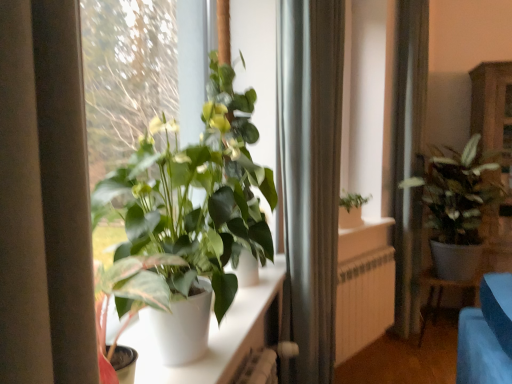
Question: From the image's perspective, does silky white curtain at right, the 2th curtain from the left, appear higher than white matte radiator at center?

Choices:
 (A) no
 (B) yes

Answer: (B)

Question: Considering the relative sizes of silky white curtain at right, which appears as the 1th curtain when viewed from the right, and white matte radiator at center in the image provided, is silky white curtain at right, which appears as the 1th curtain when viewed from the right, taller than white matte radiator at center?

Choices:
 (A) yes
 (B) no

Answer: (A)

Question: Does silky white curtain at right, the 2th curtain from the left, turn towards white matte radiator at center?

Choices:
 (A) yes
 (B) no

Answer: (B)

Question: Is silky white curtain at right, marked as the second curtain in a front-to-back arrangement, shorter than white matte radiator at center?

Choices:
 (A) yes
 (B) no

Answer: (B)

Question: From the image's perspective, does silky white curtain at right, the 2th curtain from the left, appear lower than white matte radiator at center?

Choices:
 (A) yes
 (B) no

Answer: (B)

Question: Visually, is textured green plant at right, positioned as the 2th houseplant in left-to-right order, positioned to the left or to the right of wooden cabinet at right?

Choices:
 (A) right
 (B) left

Answer: (B)

Question: From the image's perspective, is textured green plant at right, positioned as the 2th houseplant in left-to-right order, above or below wooden cabinet at right?

Choices:
 (A) above
 (B) below

Answer: (B)

Question: From their relative heights in the image, would you say textured green plant at right, the first houseplant in the back-to-front sequence, is taller or shorter than wooden cabinet at right?

Choices:
 (A) tall
 (B) short

Answer: (B)

Question: Is textured green plant at right, which is counted as the second houseplant, starting from the front, spatially inside wooden cabinet at right, or outside of it?

Choices:
 (A) outside
 (B) inside

Answer: (A)

Question: From the image's perspective, is textured green plant at right, positioned as the 2th houseplant in left-to-right order, positioned above or below white matte radiator at center?

Choices:
 (A) above
 (B) below

Answer: (A)

Question: Considering the relative positions of textured green plant at right, which is counted as the second houseplant, starting from the front, and white matte radiator at center in the image provided, is textured green plant at right, which is counted as the second houseplant, starting from the front, to the left or to the right of white matte radiator at center?

Choices:
 (A) right
 (B) left

Answer: (A)

Question: Is textured green plant at right, the first houseplant from the right, in front of or behind white matte radiator at center in the image?

Choices:
 (A) behind
 (B) front

Answer: (B)

Question: In terms of height, does textured green plant at right, which is counted as the second houseplant, starting from the front, look taller or shorter compared to white matte radiator at center?

Choices:
 (A) tall
 (B) short

Answer: (A)

Question: From the image's perspective, is green matte plant at center, the 2th houseplant in the back-to-front sequence, located above or below textured green plant at right, which is counted as the second houseplant, starting from the front?

Choices:
 (A) above
 (B) below

Answer: (A)

Question: From a real-world perspective, relative to textured green plant at right, which is counted as the second houseplant, starting from the front, is green matte plant at center, which appears as the second houseplant when viewed from the right, vertically above or below?

Choices:
 (A) above
 (B) below

Answer: (A)